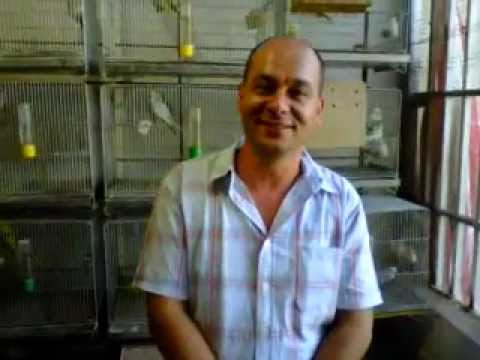
You are a GUI agent. You are given a task and a screenshot of the screen. Output one action in this format:
    pyautogui.click(x=<x>, y=<y>)
    Task: Click on the green water dispenser
    The width and height of the screenshot is (480, 360).
    Given the screenshot: What is the action you would take?
    pyautogui.click(x=197, y=152)